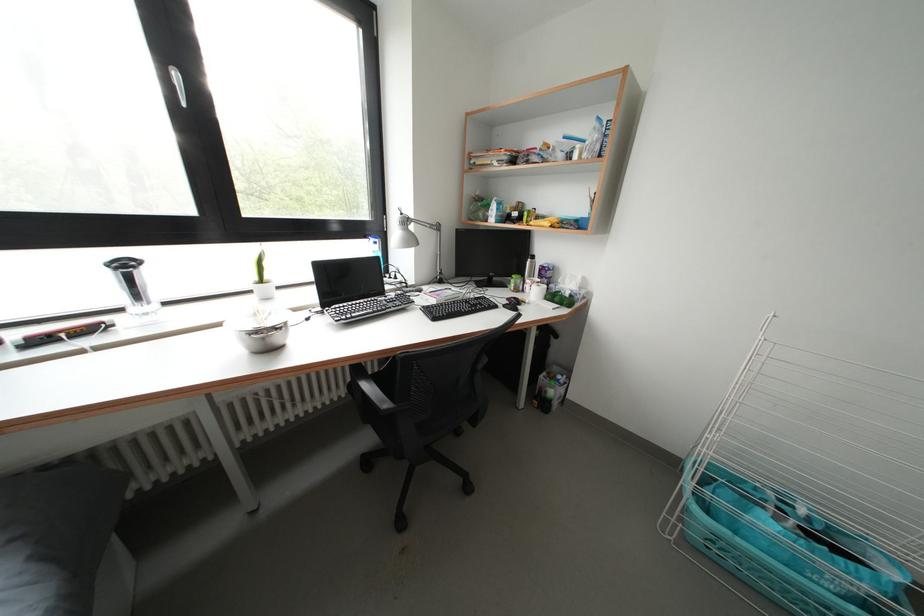
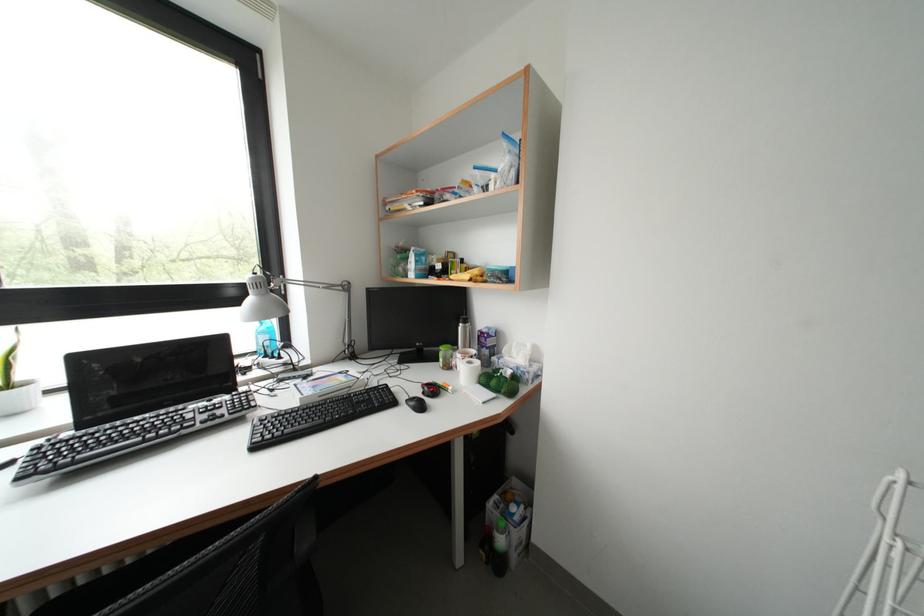
Question: The images are taken continuously from a first-person perspective. In which direction is your viewpoint rotating?

Choices:
 (A) Left
 (B) Right
 (C) Up
 (D) Down

Answer: (C)